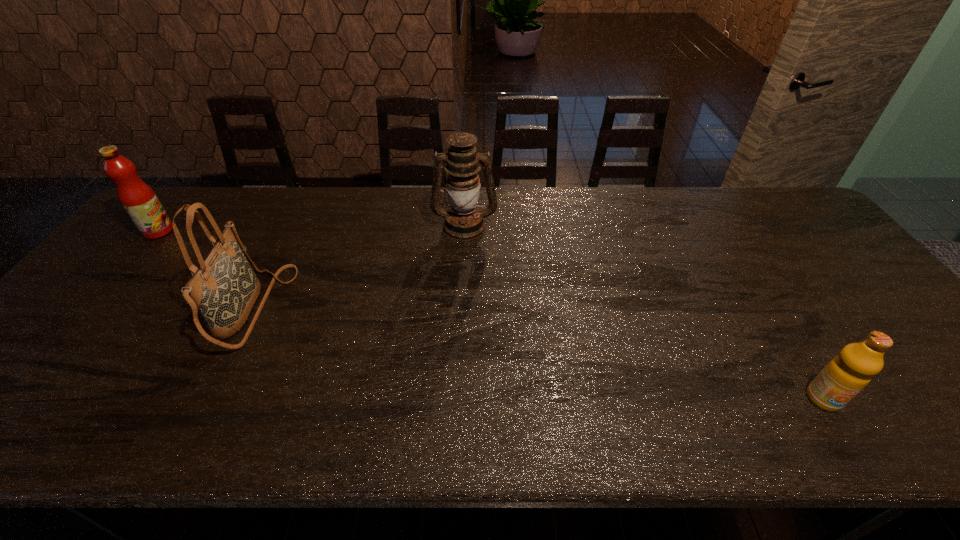
Where is `the second object from right to left`? the second object from right to left is located at coordinates (464, 221).

Where is `the third farthest object`? the third farthest object is located at coordinates (225, 288).

The height and width of the screenshot is (540, 960). I want to click on handbag, so click(225, 288).

At what (x,y) coordinates should I click in order to perform the action: click on the taller fruit juice. Please return your answer as a coordinate pair (x, y). Looking at the image, I should click on (138, 199).

Find the location of `the leftmost object`. the leftmost object is located at coordinates (138, 199).

Where is `the nearer fruit juice`? Image resolution: width=960 pixels, height=540 pixels. the nearer fruit juice is located at coordinates pos(847,374).

Image resolution: width=960 pixels, height=540 pixels. Identify the location of the shorter fruit juice. (847, 374).

Identify the location of free location located on the left of the second object from right to left. (362, 226).

At what (x,y) coordinates should I click in order to perform the action: click on free location located 0.050m on the front-facing side of the handbag. Please return your answer as a coordinate pair (x, y). The image size is (960, 540). Looking at the image, I should click on (303, 309).

Identify the location of vacant area situated on the front label of the farther fruit juice. (225, 231).